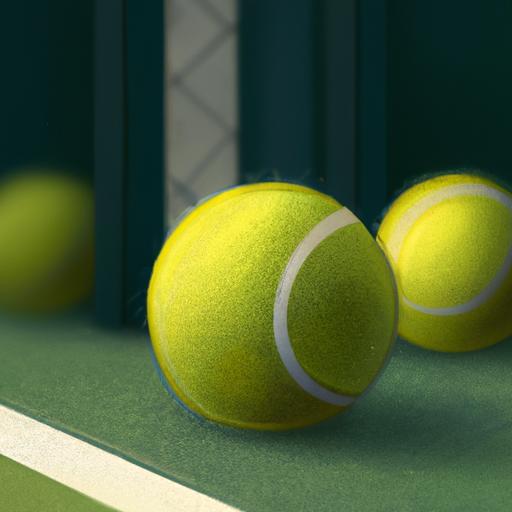
Identify the location of corners. The image size is (512, 512). (499, 503), (7, 502), (9, 10), (500, 10).